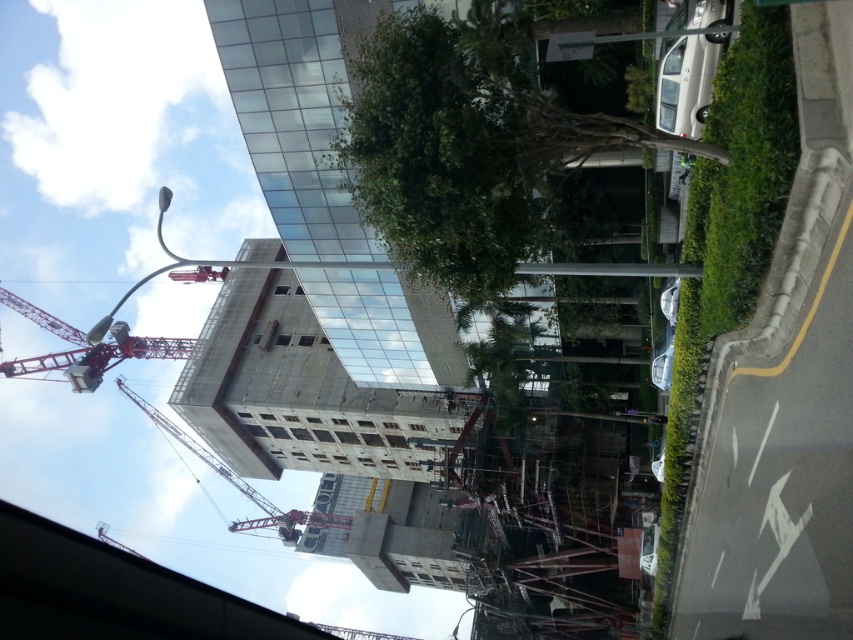
Question: Is green leafy tree at upper center smaller than red metallic crane at upper left?

Choices:
 (A) yes
 (B) no

Answer: (A)

Question: Does red metallic crane at upper left appear on the left side of red metal crane at center?

Choices:
 (A) no
 (B) yes

Answer: (B)

Question: Which object appears farthest from the camera in this image?

Choices:
 (A) red metallic crane at upper left
 (B) red metal crane at center

Answer: (B)

Question: Can you confirm if green leafy tree at upper center is positioned to the right of red metal crane at center?

Choices:
 (A) no
 (B) yes

Answer: (B)

Question: Which object is positioned closest to the red metallic crane at upper left?

Choices:
 (A) green leafy tree at upper center
 (B) red metal crane at center

Answer: (B)

Question: Which object is closer to the camera taking this photo?

Choices:
 (A) red metallic crane at upper left
 (B) red metal crane at center

Answer: (A)